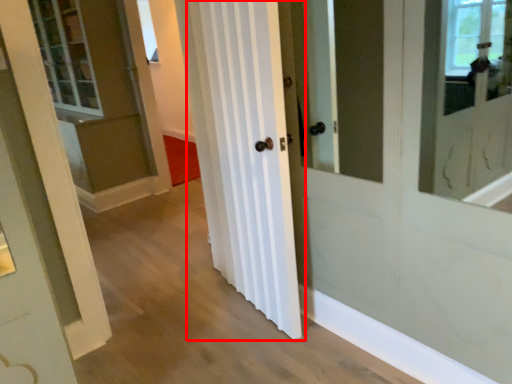
Question: From the image's perspective, considering the relative positions of curtain (annotated by the red box) and window in the image provided, where is curtain (annotated by the red box) located with respect to the staircase?

Choices:
 (A) above
 (B) below

Answer: (B)